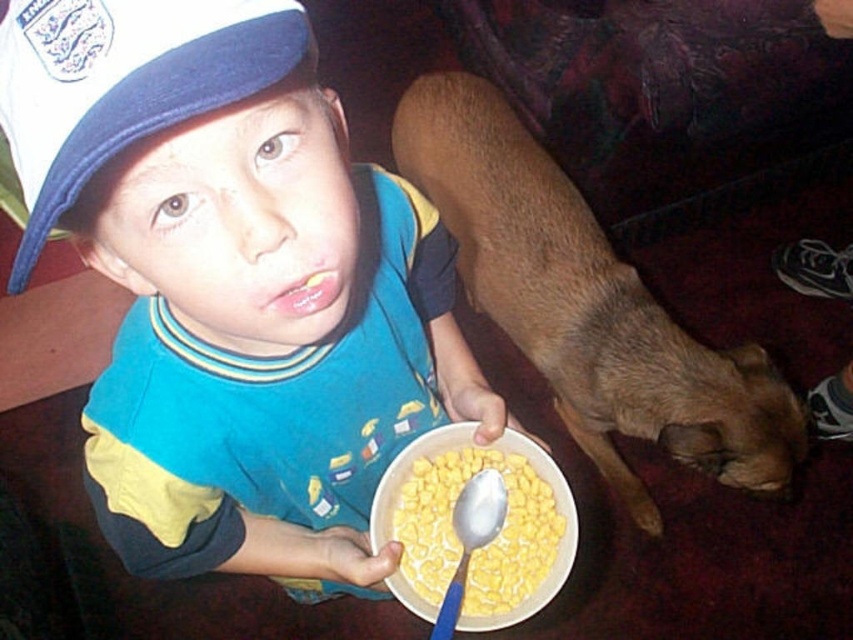
You are a photographer trying to capture the blue cotton shirt at center and the blue plastic spoon at lower center in the same frame. Since you want both objects to be clearly visible, which object should you focus on first to ensure proper focus, considering their sizes?

The blue cotton shirt at center is taller than the blue plastic spoon at lower center, so you should focus on the blue cotton shirt at center first because it is larger and requires more attention to detail to ensure clarity.

You are a photographer taking a picture of the blue fabric baseball cap at upper left and the yellow cornflakes at lower center. Which object will appear larger in the photo?

The blue fabric baseball cap at upper left will appear larger in the photo because it is closer to the viewer than the yellow cornflakes at lower center.